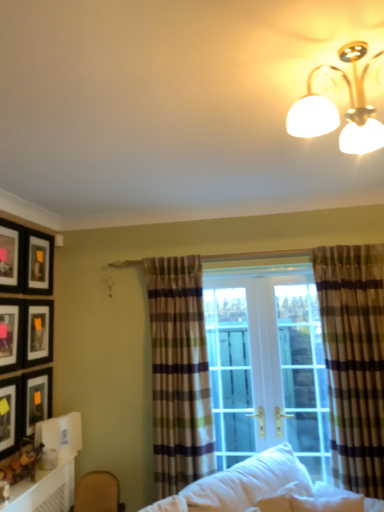
Question: Is matte black picture frame at upper left, arranged as the 6th picture frame when ordered from the bottom, touching white soft pillow at lower center?

Choices:
 (A) yes
 (B) no

Answer: (B)

Question: From a real-world perspective, is matte black picture frame at upper left, arranged as the 6th picture frame when ordered from the bottom, physically below white soft pillow at lower center?

Choices:
 (A) yes
 (B) no

Answer: (B)

Question: Is matte black picture frame at upper left, arranged as the 6th picture frame when ordered from the bottom, thinner than white soft pillow at lower center?

Choices:
 (A) yes
 (B) no

Answer: (A)

Question: Is matte black picture frame at upper left, arranged as the 6th picture frame when ordered from the bottom, facing towards white soft pillow at lower center?

Choices:
 (A) yes
 (B) no

Answer: (B)

Question: Is matte black picture frame at upper left, arranged as the 6th picture frame when ordered from the bottom, at the right side of white soft pillow at lower center?

Choices:
 (A) yes
 (B) no

Answer: (B)

Question: Is matte black picture frame at upper left, which ranks as the 1th picture frame in top-to-bottom order, further to camera compared to white soft pillow at lower center?

Choices:
 (A) no
 (B) yes

Answer: (B)

Question: Is matte black picture frame at lower left, acting as the 1th picture frame starting from the bottom, shorter than white glossy table at lower left?

Choices:
 (A) yes
 (B) no

Answer: (B)

Question: Is matte black picture frame at lower left, acting as the 6th picture frame starting from the top, thinner than white glossy table at lower left?

Choices:
 (A) no
 (B) yes

Answer: (B)

Question: Considering the relative positions of matte black picture frame at lower left, acting as the 1th picture frame starting from the bottom, and white glossy table at lower left in the image provided, is matte black picture frame at lower left, acting as the 1th picture frame starting from the bottom, to the left of white glossy table at lower left from the viewer's perspective?

Choices:
 (A) yes
 (B) no

Answer: (A)

Question: Is matte black picture frame at lower left, acting as the 6th picture frame starting from the top, wider than white glossy table at lower left?

Choices:
 (A) yes
 (B) no

Answer: (B)

Question: Could you tell me if matte black picture frame at lower left, acting as the 1th picture frame starting from the bottom, is turned towards white glossy table at lower left?

Choices:
 (A) no
 (B) yes

Answer: (A)

Question: Can you confirm if matte black picture frame at lower left, acting as the 6th picture frame starting from the top, is smaller than white glossy table at lower left?

Choices:
 (A) yes
 (B) no

Answer: (B)

Question: Is matte black picture frame at upper left, arranged as the 6th picture frame when ordered from the bottom, inside gold metallic light fixture at upper right?

Choices:
 (A) yes
 (B) no

Answer: (B)